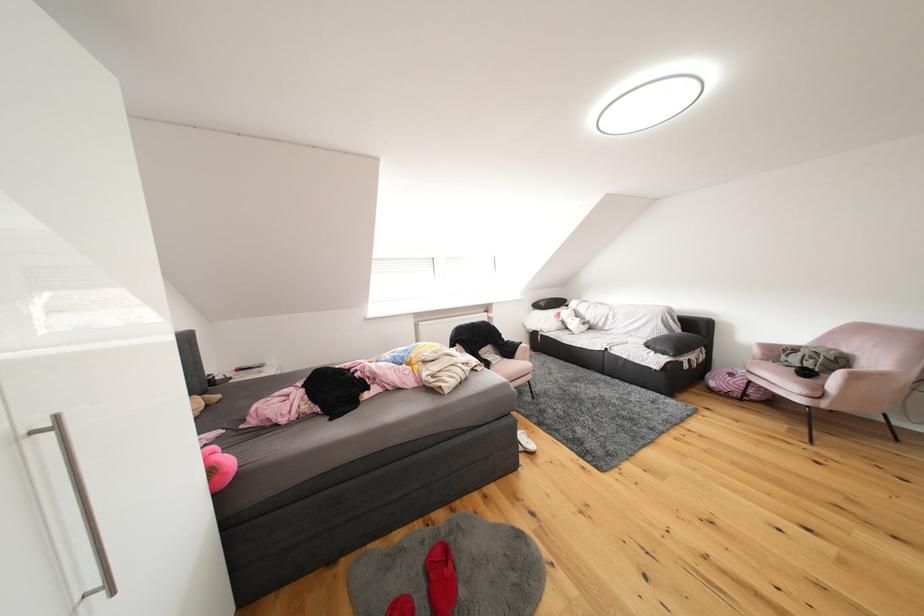
Where would you lift the dark pillow? Please return your answer as a coordinate pair (x, y).

(675, 342)